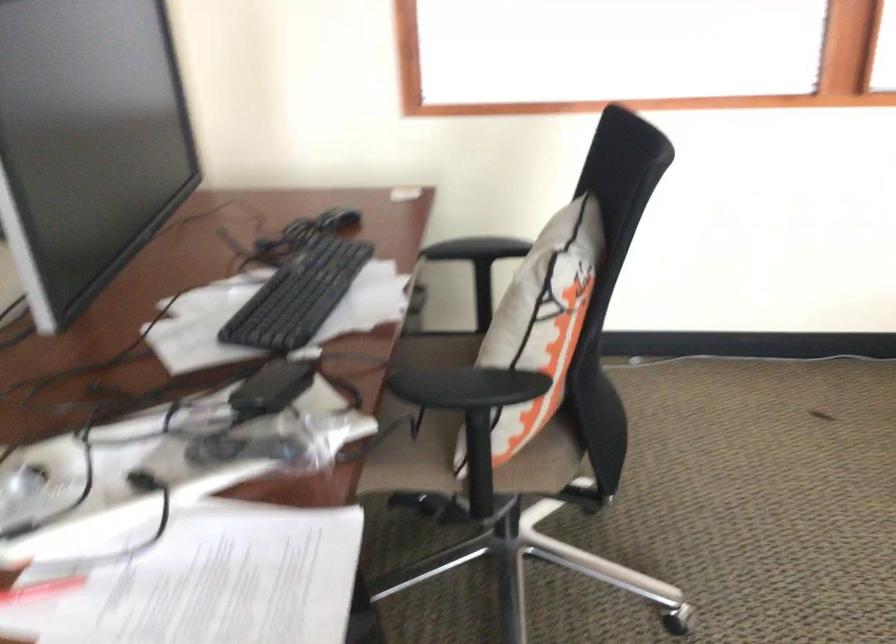
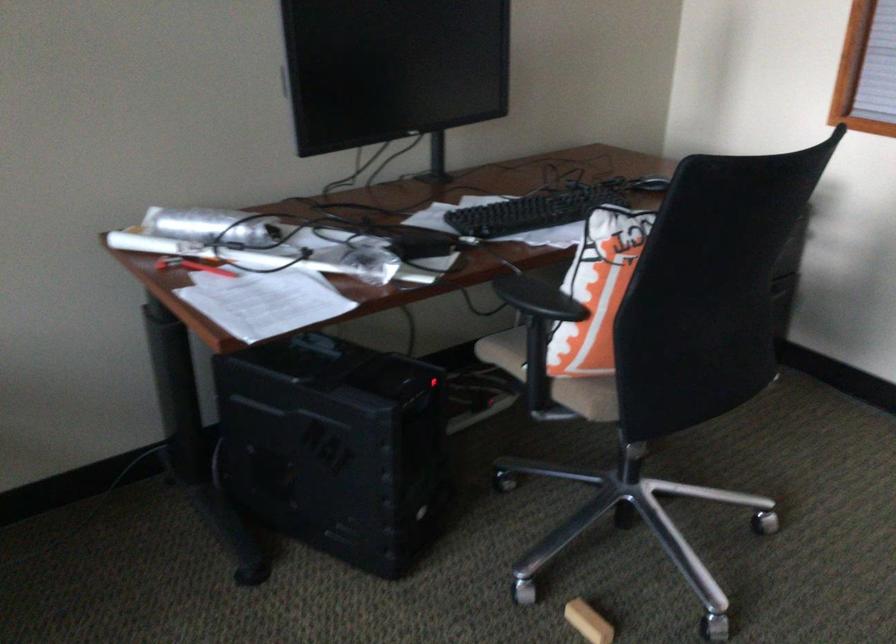
Find the pixel in the second image that matches [360,221] in the first image.

(648, 185)